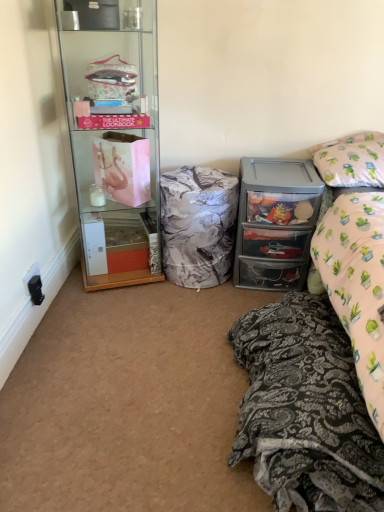
Find the location of `free space in front of clear glass cabinet at left`. free space in front of clear glass cabinet at left is located at coordinates (119, 315).